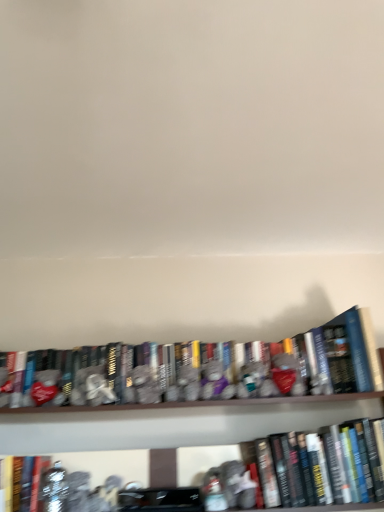
Question: Which direction should I rotate to look at hardcover book at center, the third book when ordered from left to right?

Choices:
 (A) left
 (B) right

Answer: (B)

Question: From the image's perspective, would you say hardcover book at center, the third book when ordered from left to right, is positioned over hardcover book at lower left, marked as the first book in a left-to-right arrangement?

Choices:
 (A) no
 (B) yes

Answer: (B)

Question: Does hardcover book at center, the third book when ordered from left to right, have a smaller size compared to hardcover book at lower left, marked as the first book in a left-to-right arrangement?

Choices:
 (A) yes
 (B) no

Answer: (B)

Question: Would you consider hardcover book at center, which appears as the first book when viewed from the right, to be distant from hardcover book at lower left, marked as the first book in a left-to-right arrangement?

Choices:
 (A) yes
 (B) no

Answer: (B)

Question: Can you confirm if hardcover book at center, which appears as the first book when viewed from the right, is shorter than hardcover book at lower left, marked as the first book in a left-to-right arrangement?

Choices:
 (A) yes
 (B) no

Answer: (B)

Question: Is hardcover book at center, the third book when ordered from left to right, positioned with its back to hardcover book at lower left, placed as the 3th book when sorted from right to left?

Choices:
 (A) yes
 (B) no

Answer: (B)

Question: From a real-world perspective, is hardcover book at center, the third book when ordered from left to right, located higher than hardcover book at lower left, placed as the 3th book when sorted from right to left?

Choices:
 (A) yes
 (B) no

Answer: (A)

Question: From a real-world perspective, is hardcover book at lower left, marked as the first book in a left-to-right arrangement, beneath hardcover books at center, which ranks as the 2th book in right-to-left order?

Choices:
 (A) yes
 (B) no

Answer: (A)

Question: From a real-world perspective, is hardcover book at lower left, placed as the 3th book when sorted from right to left, on top of hardcover books at center, the second book from the left?

Choices:
 (A) yes
 (B) no

Answer: (B)

Question: Can you confirm if hardcover book at lower left, marked as the first book in a left-to-right arrangement, is positioned to the left of hardcover books at center, which ranks as the 2th book in right-to-left order?

Choices:
 (A) no
 (B) yes

Answer: (B)

Question: Can you confirm if hardcover book at lower left, marked as the first book in a left-to-right arrangement, is positioned to the right of hardcover books at center, the second book from the left?

Choices:
 (A) no
 (B) yes

Answer: (A)

Question: Is the depth of hardcover book at lower left, marked as the first book in a left-to-right arrangement, greater than that of hardcover books at center, which ranks as the 2th book in right-to-left order?

Choices:
 (A) no
 (B) yes

Answer: (A)

Question: Is hardcover book at lower left, marked as the first book in a left-to-right arrangement, with hardcover books at center, the second book from the left?

Choices:
 (A) yes
 (B) no

Answer: (B)

Question: Is hardcover books at center, the second book from the left, positioned with its back to hardcover book at center, the third book when ordered from left to right?

Choices:
 (A) no
 (B) yes

Answer: (A)